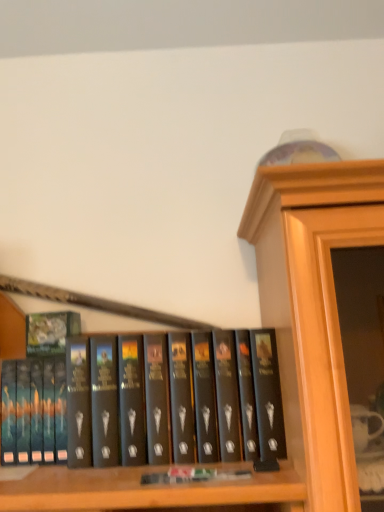
Question: Choose the correct answer: Is black matte book at center inside green matte book at left or outside it?

Choices:
 (A) outside
 (B) inside

Answer: (A)

Question: From the image's perspective, relative to green matte book at left, is black matte book at center above or below?

Choices:
 (A) below
 (B) above

Answer: (A)

Question: Is black matte book at center taller or shorter than green matte book at left?

Choices:
 (A) short
 (B) tall

Answer: (B)

Question: From a real-world perspective, is green matte book at left above or below black matte book at center?

Choices:
 (A) below
 (B) above

Answer: (B)

Question: Does point (56, 344) appear closer or farther from the camera than point (271, 453)?

Choices:
 (A) closer
 (B) farther

Answer: (B)

Question: In the image, is green matte book at left positioned in front of or behind black matte book at center?

Choices:
 (A) front
 (B) behind

Answer: (B)

Question: Considering the positions of green matte book at left and black matte book at center in the image, is green matte book at left wider or thinner than black matte book at center?

Choices:
 (A) thin
 (B) wide

Answer: (A)